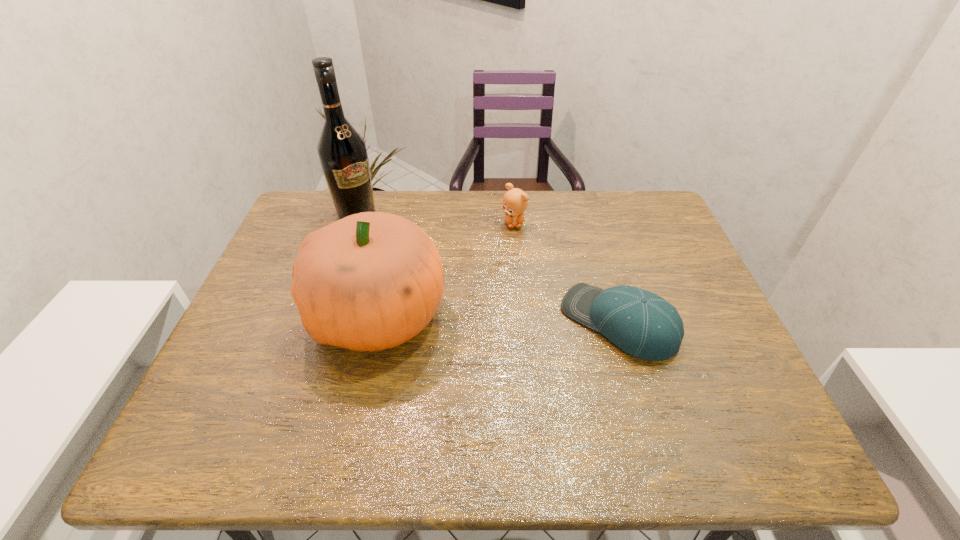
You are a GUI agent. You are given a task and a screenshot of the screen. Output one action in this format:
    pyautogui.click(x=<x>, y=<y>)
    Task: Click on the empty location between the pumpkin and the second object from right to left
    The image size is (960, 540).
    Given the screenshot: What is the action you would take?
    pyautogui.click(x=446, y=269)

Identify the location of free point between the shortest object and the wine bottle. (487, 268).

Find the location of a particular element. free space between the shortest object and the second shortest object is located at coordinates (565, 273).

Find the location of a particular element. The image size is (960, 540). vacant area between the third tallest object and the baseball cap is located at coordinates (565, 273).

I want to click on vacant area that lies between the teddy bear and the rightmost object, so click(565, 273).

The image size is (960, 540). I want to click on vacant space that is in between the second shortest object and the pumpkin, so click(x=446, y=269).

You are a GUI agent. You are given a task and a screenshot of the screen. Output one action in this format:
    pyautogui.click(x=<x>, y=<y>)
    Task: Click on the object that is the closest to the third object from left to right
    This screenshot has width=960, height=540.
    Given the screenshot: What is the action you would take?
    pyautogui.click(x=370, y=281)

Identify which object is the second nearest to the baseball cap. Please provide its 2D coordinates. Your answer should be formatted as a tuple, i.e. [(x, y)], where the tuple contains the x and y coordinates of a point satisfying the conditions above.

[(370, 281)]

Identify the location of vacant region that satisfies the following two spatial constraints: 1. on the front side of the pumpkin; 2. on the face of the wine bottle. This screenshot has width=960, height=540. (324, 314).

This screenshot has height=540, width=960. Find the location of `vacant space that satisfies the following two spatial constraints: 1. on the front side of the tallest object; 2. on the right side of the third tallest object`. vacant space that satisfies the following two spatial constraints: 1. on the front side of the tallest object; 2. on the right side of the third tallest object is located at coordinates (354, 223).